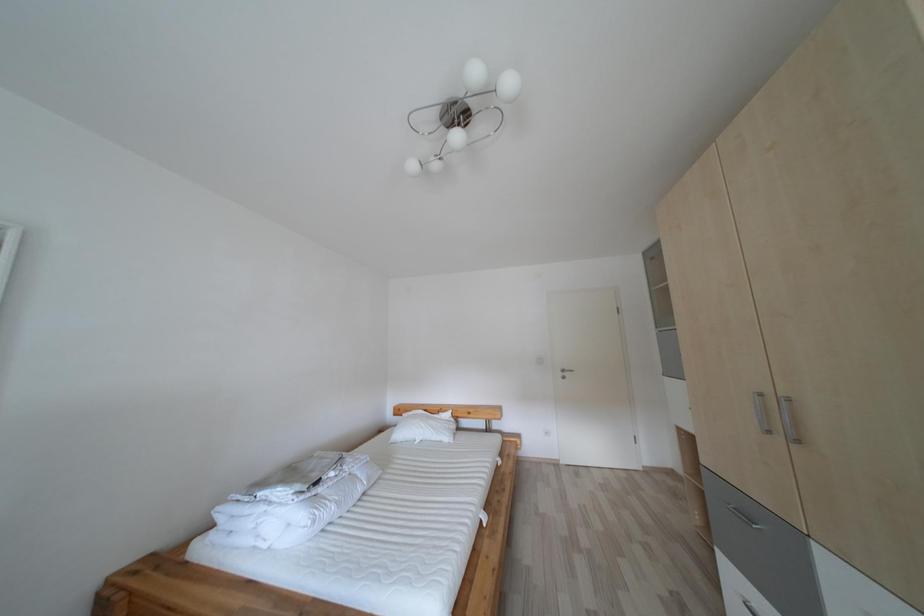
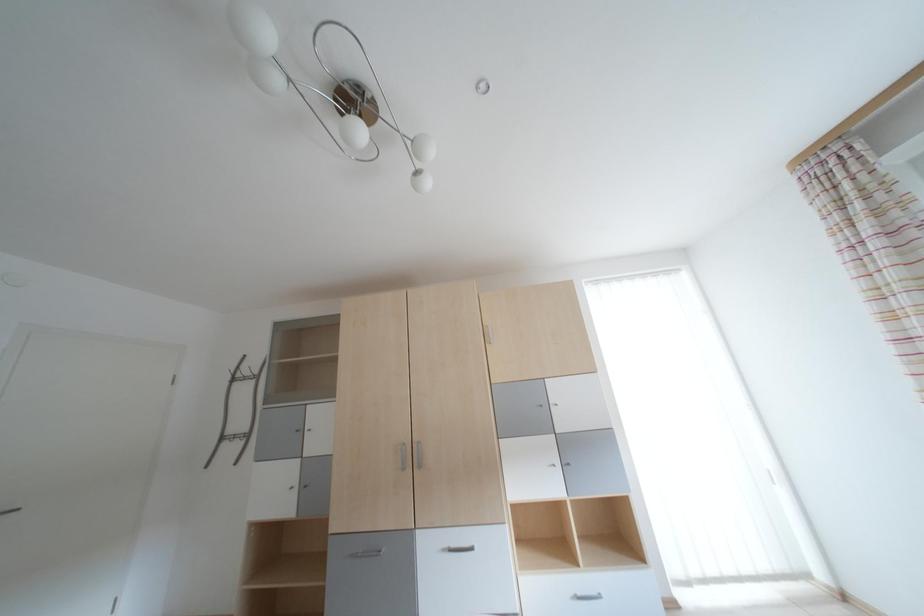
Consider the image. The first image is from the beginning of the video and the second image is from the end. How did the camera likely rotate when shooting the video?

The camera rotated toward right-up.